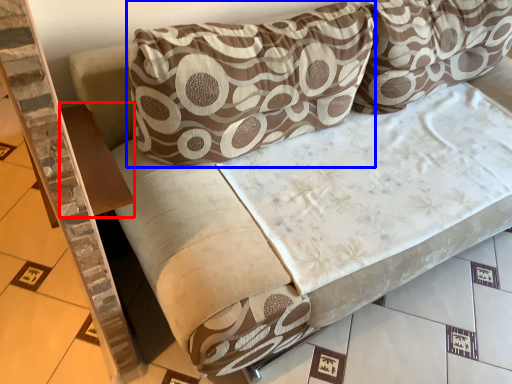
Question: Among these objects, which one is farthest to the camera, table (highlighted by a red box) or pillow (highlighted by a blue box)?

Choices:
 (A) table
 (B) pillow

Answer: (A)